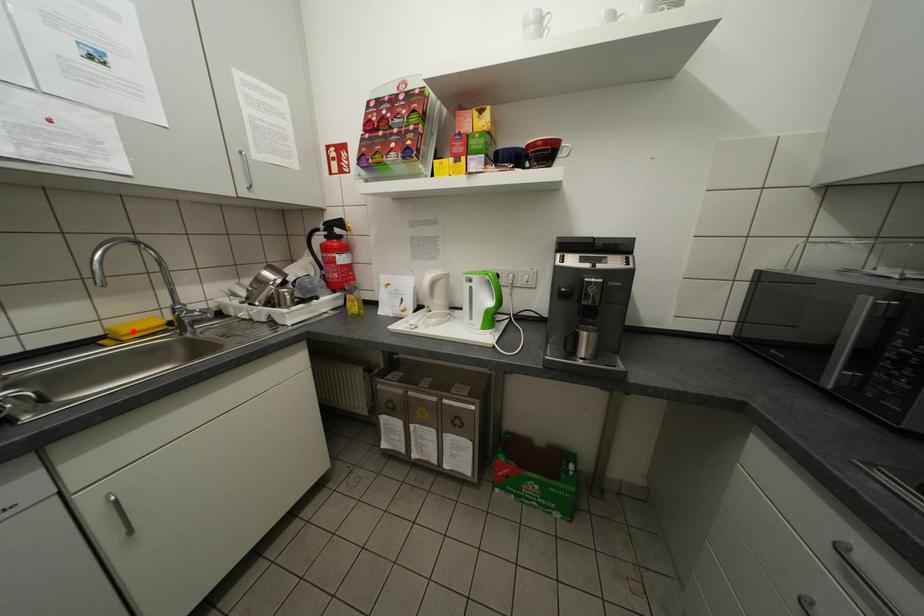
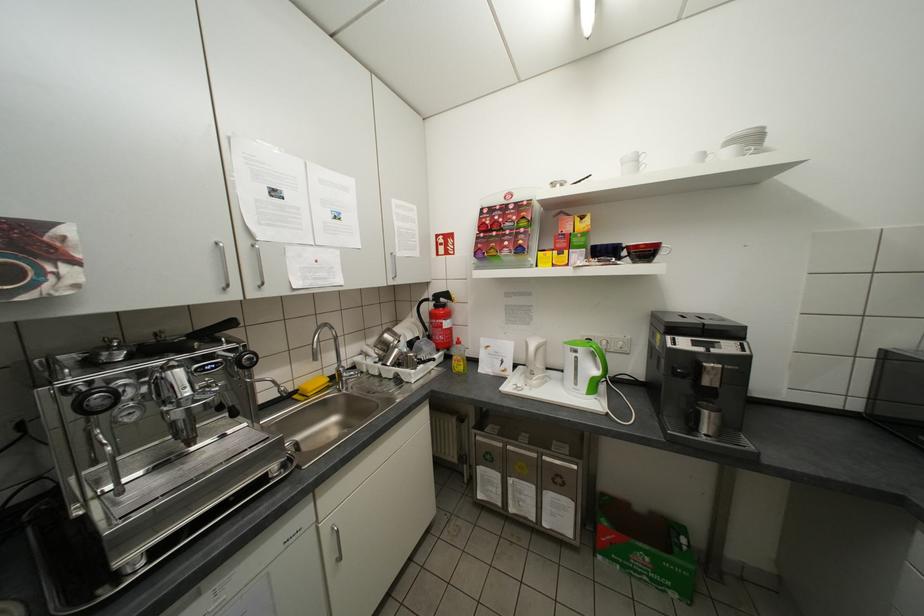
Locate, in the second image, the point that corresponds to the highlighted location in the first image.

(319, 389)